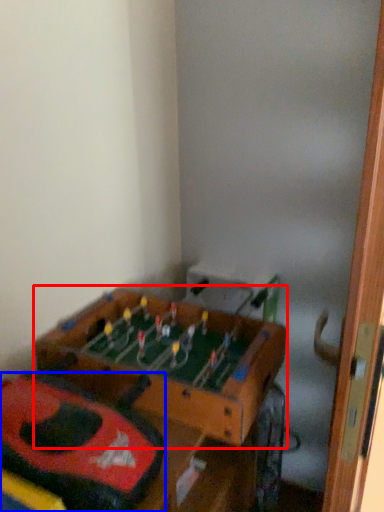
Question: Which point is further to the camera, table (highlighted by a red box) or kit (highlighted by a blue box)?

Choices:
 (A) table
 (B) kit

Answer: (A)